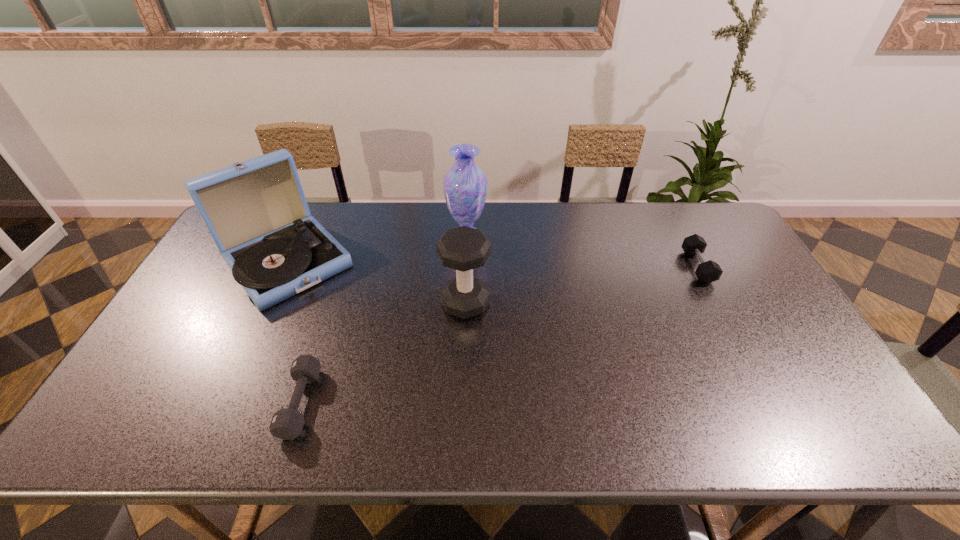
Where is `vacant region located on the left of the third shortest object`? This screenshot has height=540, width=960. vacant region located on the left of the third shortest object is located at coordinates (368, 303).

The width and height of the screenshot is (960, 540). Identify the location of free spot located on the left of the rightmost object. (614, 267).

The image size is (960, 540). What are the coordinates of `vacant space located 0.320m on the left of the nearest object` in the screenshot? It's located at (153, 402).

Where is `vase positioned at the far edge`? The height and width of the screenshot is (540, 960). vase positioned at the far edge is located at coordinates coord(465,185).

This screenshot has height=540, width=960. I want to click on phonograph record at the far edge, so click(256, 212).

You are a GUI agent. You are given a task and a screenshot of the screen. Output one action in this format:
    pyautogui.click(x=<x>, y=<y>)
    Task: Click on the object located at the near edge
    This screenshot has width=960, height=540.
    Given the screenshot: What is the action you would take?
    pyautogui.click(x=287, y=423)

This screenshot has width=960, height=540. In order to click on object present at the left edge in this screenshot , I will do `click(256, 212)`.

Identify the location of object that is at the right edge. The image size is (960, 540). (707, 272).

What are the coordinates of `object located in the far left corner section of the desktop` in the screenshot? It's located at (256, 212).

Locate an element on the screen. free space at the far edge is located at coordinates (427, 231).